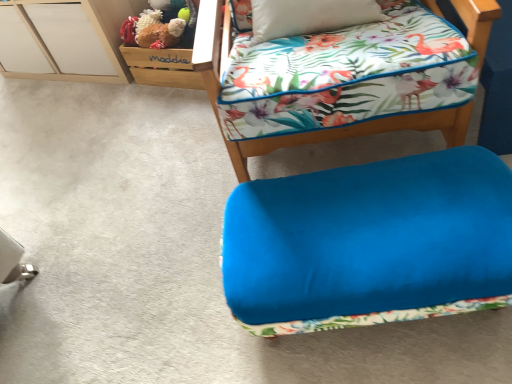
You are a GUI agent. You are given a task and a screenshot of the screen. Output one action in this format:
    pyautogui.click(x=<x>, y=<y>)
    Task: Click on the fluffy brown teddy bear at upper left
    
    Given the screenshot: What is the action you would take?
    pyautogui.click(x=159, y=33)

Image resolution: width=512 pixels, height=384 pixels. What do you see at coordinates (65, 39) in the screenshot?
I see `white matte file cabinet at upper left` at bounding box center [65, 39].

Find the location of a particular element. velvet blue ottoman at lower center, which appears as the 2th furniture when ordered from the bottom is located at coordinates (307, 132).

What do you see at coordinates (370, 243) in the screenshot? This screenshot has height=384, width=512. I see `velvet blue ottoman at lower right, the 2th furniture viewed from the top` at bounding box center [370, 243].

Where is `fluffy brown teddy bear at upper left`? The image size is (512, 384). fluffy brown teddy bear at upper left is located at coordinates click(x=159, y=33).

Where is `furniture that is the 2nd one when counting forward from the fluffy brown teddy bear at upper left`? The image size is (512, 384). furniture that is the 2nd one when counting forward from the fluffy brown teddy bear at upper left is located at coordinates (307, 132).

In terms of width, does velvet blue ottoman at lower center, which appears as the 2th furniture when ordered from the bottom, look wider or thinner when compared to fluffy brown teddy bear at upper left?

In the image, velvet blue ottoman at lower center, which appears as the 2th furniture when ordered from the bottom, appears to be wider than fluffy brown teddy bear at upper left.

Which object is further away from the camera taking this photo, velvet blue ottoman at lower center, arranged as the 1th furniture when viewed from the top, or fluffy brown teddy bear at upper left?

Positioned behind is fluffy brown teddy bear at upper left.

Between point (207, 77) and point (176, 36), which one is positioned in front?

Point (207, 77)

Which of these two, velvet blue ottoman at lower right, the 2th furniture viewed from the top, or white matte file cabinet at upper left, stands shorter?

Standing shorter between the two is velvet blue ottoman at lower right, the 2th furniture viewed from the top.

Does point (459, 191) appear closer or farther from the camera than point (32, 1)?

Point (459, 191) appears to be closer to the viewer than point (32, 1).

Is velvet blue ottoman at lower right, which appears as the first furniture when ordered from the bottom, surrounding white matte file cabinet at upper left?

Definitely not — white matte file cabinet at upper left is not inside velvet blue ottoman at lower right, which appears as the first furniture when ordered from the bottom.

Which of these two, velvet blue ottoman at lower right, which appears as the first furniture when ordered from the bottom, or white matte file cabinet at upper left, is smaller?

velvet blue ottoman at lower right, which appears as the first furniture when ordered from the bottom, is smaller.

Where is `animal above the white matte file cabinet at upper left (from a real-world perspective)`? The width and height of the screenshot is (512, 384). animal above the white matte file cabinet at upper left (from a real-world perspective) is located at coordinates (159, 33).

From the image's perspective, is fluffy brown teddy bear at upper left positioned above or below white matte file cabinet at upper left?

From the image's perspective, fluffy brown teddy bear at upper left appears below white matte file cabinet at upper left.

In terms of size, does fluffy brown teddy bear at upper left appear bigger or smaller than velvet blue ottoman at lower right, which appears as the first furniture when ordered from the bottom?

In the image, fluffy brown teddy bear at upper left appears to be smaller than velvet blue ottoman at lower right, which appears as the first furniture when ordered from the bottom.

Where is `animal on the left of the velvet blue ottoman at lower right, which appears as the first furniture when ordered from the bottom`? animal on the left of the velvet blue ottoman at lower right, which appears as the first furniture when ordered from the bottom is located at coordinates (159, 33).

From a real-world perspective, which object rests below the other?

In real-world perspective, velvet blue ottoman at lower right, which appears as the first furniture when ordered from the bottom, is lower.

Considering the positions of objects velvet blue ottoman at lower right, which appears as the first furniture when ordered from the bottom, and velvet blue ottoman at lower center, which appears as the 2th furniture when ordered from the bottom, in the image provided, who is in front, velvet blue ottoman at lower right, which appears as the first furniture when ordered from the bottom, or velvet blue ottoman at lower center, which appears as the 2th furniture when ordered from the bottom,?

velvet blue ottoman at lower center, which appears as the 2th furniture when ordered from the bottom, is closer to the camera.

How distant is velvet blue ottoman at lower right, the 2th furniture viewed from the top, from velvet blue ottoman at lower center, arranged as the 1th furniture when viewed from the top?

A distance of 10.81 inches exists between velvet blue ottoman at lower right, the 2th furniture viewed from the top, and velvet blue ottoman at lower center, arranged as the 1th furniture when viewed from the top.

Between velvet blue ottoman at lower right, the 2th furniture viewed from the top, and velvet blue ottoman at lower center, arranged as the 1th furniture when viewed from the top, which one has less height?

velvet blue ottoman at lower right, the 2th furniture viewed from the top.

Is the surface of white matte file cabinet at upper left in direct contact with velvet blue ottoman at lower center, which appears as the 2th furniture when ordered from the bottom?

white matte file cabinet at upper left is not next to velvet blue ottoman at lower center, which appears as the 2th furniture when ordered from the bottom, and they're not touching.

From the image's perspective, is white matte file cabinet at upper left located above or below velvet blue ottoman at lower center, which appears as the 2th furniture when ordered from the bottom?

white matte file cabinet at upper left is above velvet blue ottoman at lower center, which appears as the 2th furniture when ordered from the bottom.

From a real-world perspective, is white matte file cabinet at upper left located beneath velvet blue ottoman at lower center, which appears as the 2th furniture when ordered from the bottom?

Yes.

Is point (61, 22) farther from viewer compared to point (208, 21)?

Yes, it is.

Are white matte file cabinet at upper left and velvet blue ottoman at lower right, which appears as the first furniture when ordered from the bottom, far apart?

Yes, white matte file cabinet at upper left and velvet blue ottoman at lower right, which appears as the first furniture when ordered from the bottom, are located far from each other.

Does white matte file cabinet at upper left have a lesser width compared to velvet blue ottoman at lower right, the 2th furniture viewed from the top?

No, white matte file cabinet at upper left is not thinner than velvet blue ottoman at lower right, the 2th furniture viewed from the top.

How distant is white matte file cabinet at upper left from velvet blue ottoman at lower right, which appears as the first furniture when ordered from the bottom?

1.30 meters.

Is white matte file cabinet at upper left at the left side of velvet blue ottoman at lower right, which appears as the first furniture when ordered from the bottom?

Correct, you'll find white matte file cabinet at upper left to the left of velvet blue ottoman at lower right, which appears as the first furniture when ordered from the bottom.

This screenshot has height=384, width=512. Find the location of `furniture that is the 1st object to the right of the fluffy brown teddy bear at upper left, starting at the anchor`. furniture that is the 1st object to the right of the fluffy brown teddy bear at upper left, starting at the anchor is located at coordinates (307, 132).

Find the location of a particular element. file cabinet behind the velvet blue ottoman at lower right, which appears as the first furniture when ordered from the bottom is located at coordinates (65, 39).

Based on their spatial positions, is fluffy brown teddy bear at upper left or velvet blue ottoman at lower center, arranged as the 1th furniture when viewed from the top, closer to velvet blue ottoman at lower right, which appears as the first furniture when ordered from the bottom?

velvet blue ottoman at lower center, arranged as the 1th furniture when viewed from the top, lies closer to velvet blue ottoman at lower right, which appears as the first furniture when ordered from the bottom, than the other object.

From the image, which object appears to be farther from white matte file cabinet at upper left, velvet blue ottoman at lower right, which appears as the first furniture when ordered from the bottom, or fluffy brown teddy bear at upper left?

velvet blue ottoman at lower right, which appears as the first furniture when ordered from the bottom, lies further to white matte file cabinet at upper left than the other object.

Estimate the real-world distances between objects in this image. Which object is further from velvet blue ottoman at lower center, arranged as the 1th furniture when viewed from the top, fluffy brown teddy bear at upper left or velvet blue ottoman at lower right, which appears as the first furniture when ordered from the bottom?

Answer: The object further to velvet blue ottoman at lower center, arranged as the 1th furniture when viewed from the top, is fluffy brown teddy bear at upper left.

When comparing their distances from velvet blue ottoman at lower right, the 2th furniture viewed from the top, does white matte file cabinet at upper left or fluffy brown teddy bear at upper left seem further?

The object further to velvet blue ottoman at lower right, the 2th furniture viewed from the top, is white matte file cabinet at upper left.

Looking at the image, which one is located further to fluffy brown teddy bear at upper left, velvet blue ottoman at lower right, the 2th furniture viewed from the top, or white matte file cabinet at upper left?

velvet blue ottoman at lower right, the 2th furniture viewed from the top, is positioned further to the anchor fluffy brown teddy bear at upper left.

Considering their positions, is white matte file cabinet at upper left positioned closer to velvet blue ottoman at lower center, which appears as the 2th furniture when ordered from the bottom, than fluffy brown teddy bear at upper left?

fluffy brown teddy bear at upper left.

From the image, which object appears to be nearer to velvet blue ottoman at lower right, which appears as the first furniture when ordered from the bottom, white matte file cabinet at upper left or velvet blue ottoman at lower center, arranged as the 1th furniture when viewed from the top?

velvet blue ottoman at lower center, arranged as the 1th furniture when viewed from the top, lies closer to velvet blue ottoman at lower right, which appears as the first furniture when ordered from the bottom, than the other object.

When comparing their distances from velvet blue ottoman at lower right, the 2th furniture viewed from the top, does fluffy brown teddy bear at upper left or white matte file cabinet at upper left seem closer?

fluffy brown teddy bear at upper left lies closer to velvet blue ottoman at lower right, the 2th furniture viewed from the top, than the other object.

Where is `furniture between velvet blue ottoman at lower center, arranged as the 1th furniture when viewed from the top, and fluffy brown teddy bear at upper left, along the z-axis`? The image size is (512, 384). furniture between velvet blue ottoman at lower center, arranged as the 1th furniture when viewed from the top, and fluffy brown teddy bear at upper left, along the z-axis is located at coordinates (370, 243).

The image size is (512, 384). I want to click on furniture between white matte file cabinet at upper left and velvet blue ottoman at lower right, the 2th furniture viewed from the top, from left to right, so click(307, 132).

Locate an element on the screen. The height and width of the screenshot is (384, 512). animal located between white matte file cabinet at upper left and velvet blue ottoman at lower center, arranged as the 1th furniture when viewed from the top, in the left-right direction is located at coordinates (159, 33).

The image size is (512, 384). What are the coordinates of `animal between white matte file cabinet at upper left and velvet blue ottoman at lower right, which appears as the first furniture when ordered from the bottom, in the horizontal direction` in the screenshot? It's located at (159, 33).